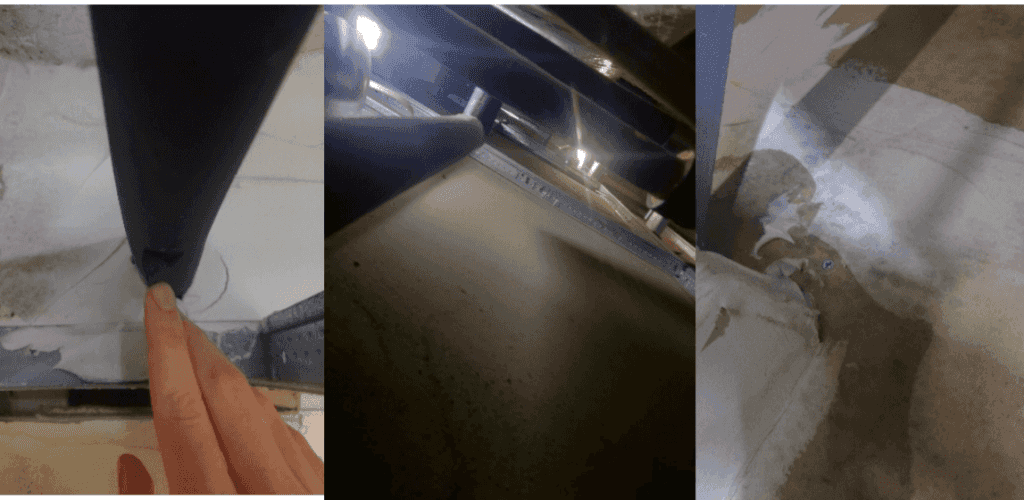
Where is `windows`? Image resolution: width=1024 pixels, height=500 pixels. windows is located at coordinates (371, 36), (574, 158), (592, 171).